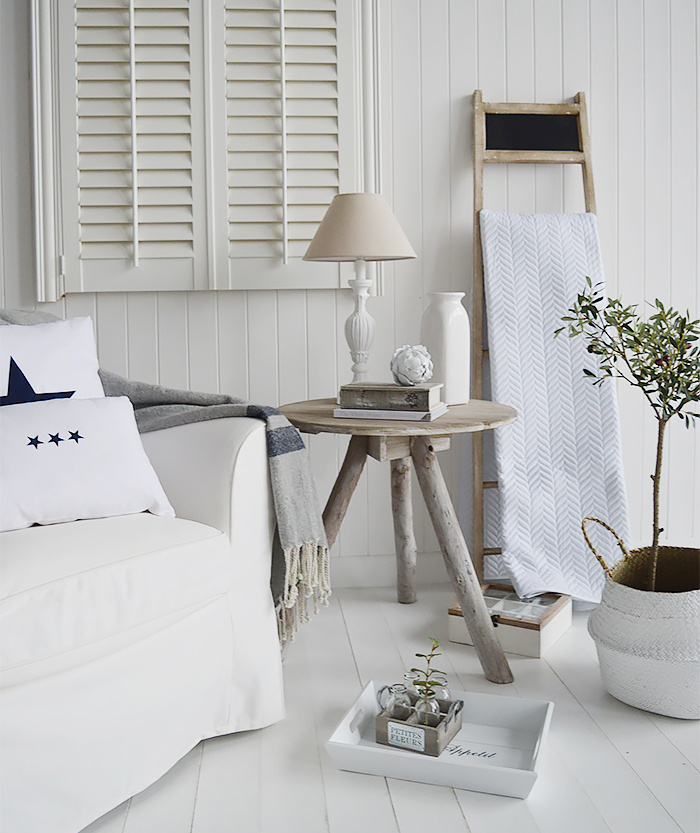
Identify the location of tray. Image resolution: width=700 pixels, height=833 pixels. (505, 740).